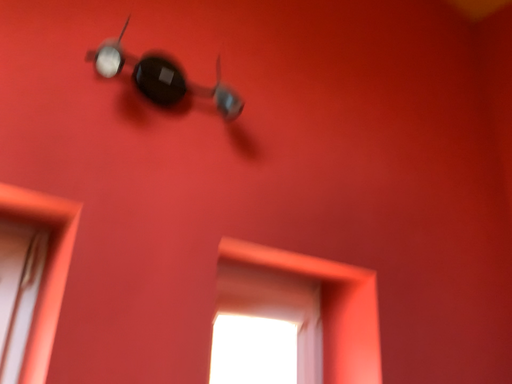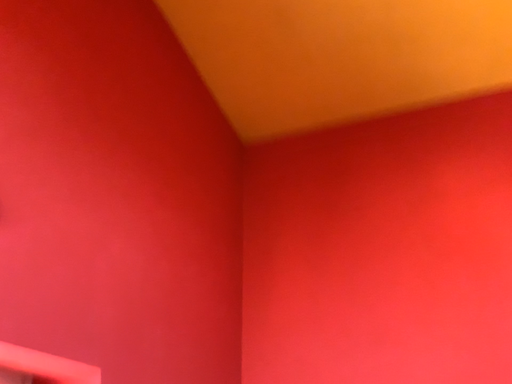
Question: Which way did the camera rotate in the video?

Choices:
 (A) rotated right
 (B) rotated left

Answer: (A)